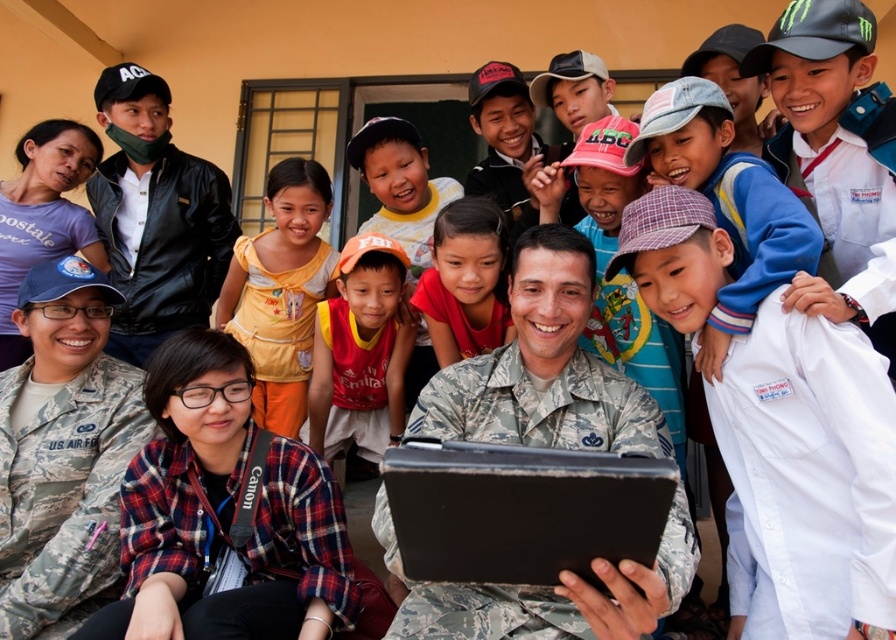
Question: Which point is farther to the camera?

Choices:
 (A) (375, 413)
 (B) (461, 211)
 (C) (560, 586)
 (D) (707, 262)

Answer: (A)

Question: Can you confirm if white cotton shirt at center is wider than red/yellow jersey at center?

Choices:
 (A) no
 (B) yes

Answer: (B)

Question: Which object appears farthest from the camera in this image?

Choices:
 (A) camouflage fabric us air force uniform at lower left
 (B) black matte laptop at center

Answer: (A)

Question: Does camouflage uniform at center have a greater width compared to red/yellow jersey at center?

Choices:
 (A) yes
 (B) no

Answer: (A)

Question: Can you confirm if camouflage fabric us air force uniform at lower left is wider than red/yellow jersey at center?

Choices:
 (A) no
 (B) yes

Answer: (B)

Question: Which object appears closest to the camera in this image?

Choices:
 (A) yellow cotton dress at center
 (B) black leather jacket at upper left

Answer: (A)